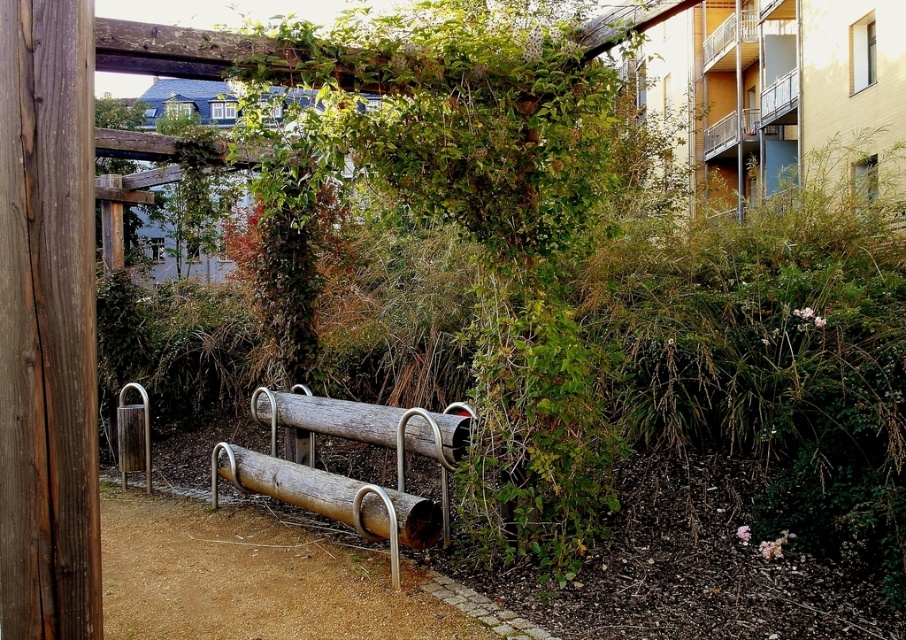
Question: Is brown wood pole at left thinner than brown wood log at center?

Choices:
 (A) yes
 (B) no

Answer: (A)

Question: Which of these objects is positioned farthest from the rusty metal log at center?

Choices:
 (A) brown wood log at center
 (B) brown wood pole at left

Answer: (B)

Question: Is brown wood pole at left further to camera compared to rusty metal log at center?

Choices:
 (A) no
 (B) yes

Answer: (A)

Question: Which of these objects is positioned closest to the brown wood pole at left?

Choices:
 (A) rusty metal log at center
 (B) brown wood log at center

Answer: (A)

Question: Which of the following is the closest to the observer?

Choices:
 (A) rusty metal log at center
 (B) brown wood pole at left
 (C) brown wood log at center

Answer: (B)

Question: Is brown wood pole at left above brown wood log at center?

Choices:
 (A) yes
 (B) no

Answer: (A)